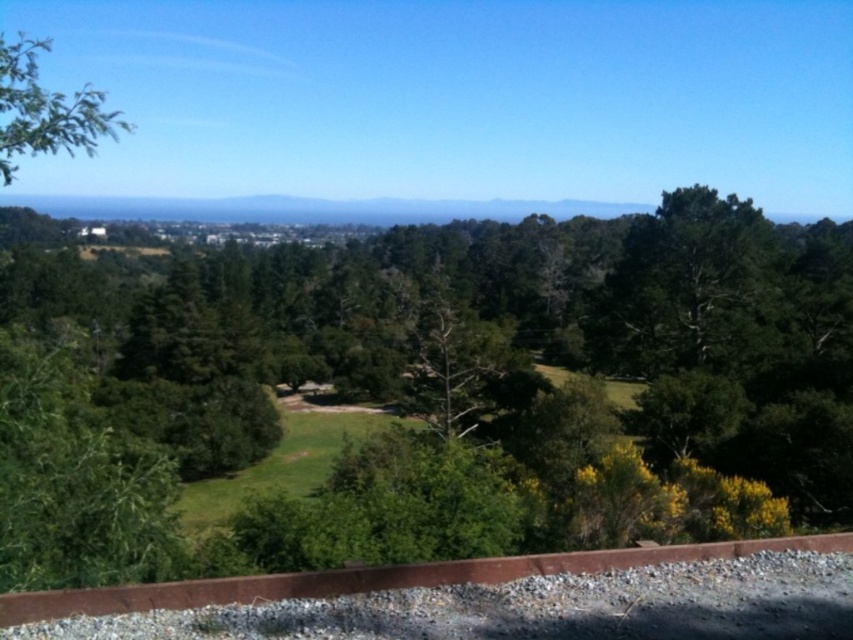
How distant is green leafy tree at center from green leafy tree at upper left?

green leafy tree at center and green leafy tree at upper left are 148.76 feet apart from each other.

Consider the image. Can you confirm if green leafy tree at center is bigger than green leafy tree at upper left?

Actually, green leafy tree at center might be smaller than green leafy tree at upper left.

Who is more distant from viewer, (166,429) or (25,134)?

Positioned behind is point (166,429).

Identify the location of green leafy tree at center. The width and height of the screenshot is (853, 640). (428, 392).